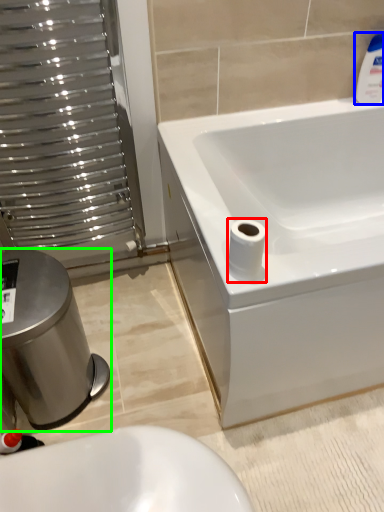
Question: Estimate the real-world distances between objects in this image. Which object is farther from toilet paper (highlighted by a red box), cleaning product (highlighted by a blue box) or bidet (highlighted by a green box)?

Choices:
 (A) cleaning product
 (B) bidet

Answer: (A)